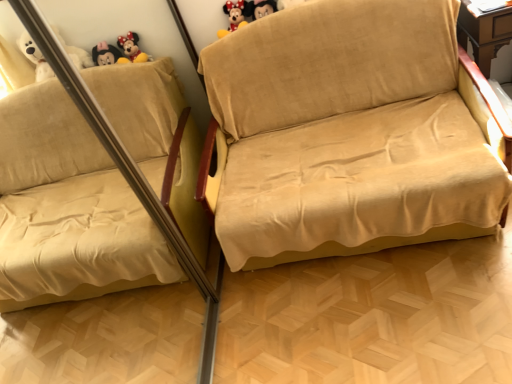
Question: Would you say velvet yellow plush toy at upper center is to the left or to the right of beige fabric couch at center in the picture?

Choices:
 (A) left
 (B) right

Answer: (A)

Question: Relative to beige fabric couch at center, is velvet yellow plush toy at upper center in front or behind?

Choices:
 (A) front
 (B) behind

Answer: (B)

Question: In terms of width, does velvet yellow plush toy at upper center look wider or thinner when compared to beige fabric couch at center?

Choices:
 (A) thin
 (B) wide

Answer: (A)

Question: From a real-world perspective, is beige fabric couch at center physically located above or below velvet yellow plush toy at upper center?

Choices:
 (A) above
 (B) below

Answer: (B)

Question: Is point (278, 72) positioned closer to the camera than point (227, 31)?

Choices:
 (A) closer
 (B) farther

Answer: (A)

Question: In terms of size, does beige fabric couch at center appear bigger or smaller than velvet yellow plush toy at upper center?

Choices:
 (A) small
 (B) big

Answer: (B)

Question: Considering the positions of beige fabric couch at center and velvet yellow plush toy at upper center in the image, is beige fabric couch at center wider or thinner than velvet yellow plush toy at upper center?

Choices:
 (A) thin
 (B) wide

Answer: (B)